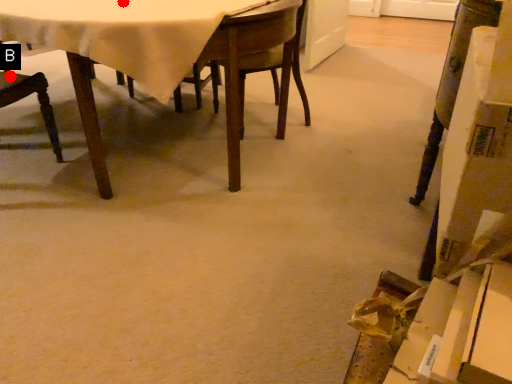
Question: Two points are circled on the image, labeled by A and B beside each circle. Which of the following is the farthest from the observer?

Choices:
 (A) A is further
 (B) B is further

Answer: (B)